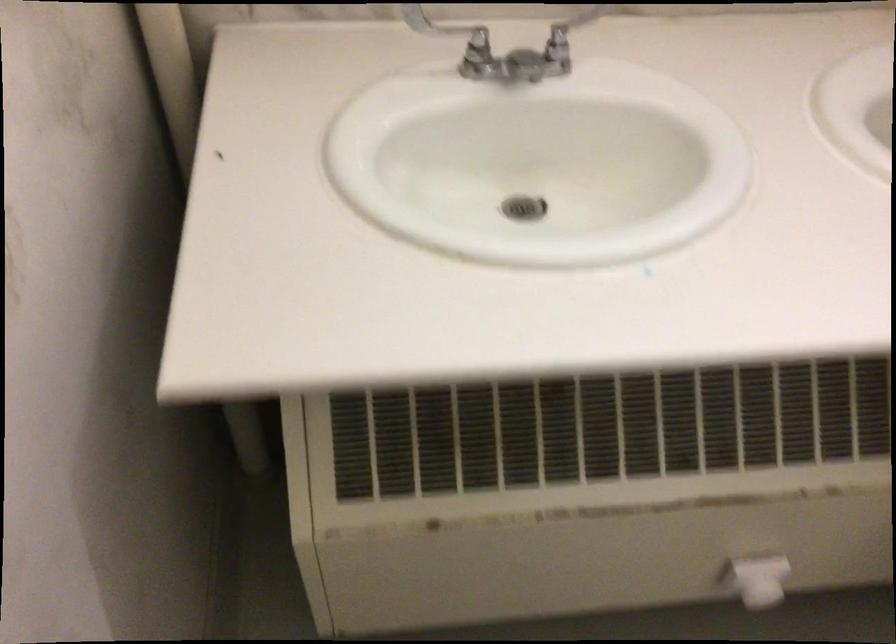
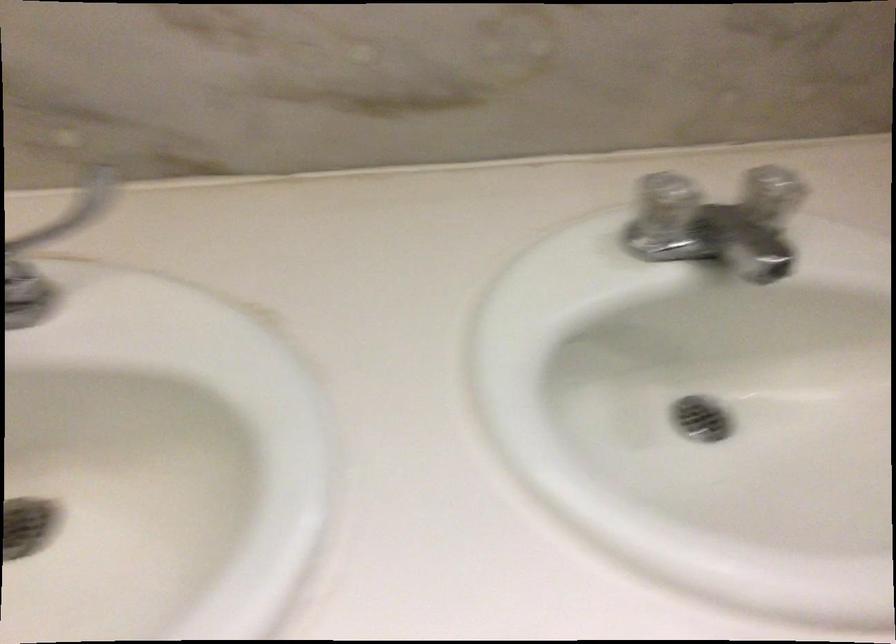
Question: The camera is either moving clockwise (left) or counter-clockwise (right) around the object. The first image is from the beginning of the video and the second image is from the end. Is the camera moving left or right when shooting the video?

Choices:
 (A) Left
 (B) Right

Answer: (A)